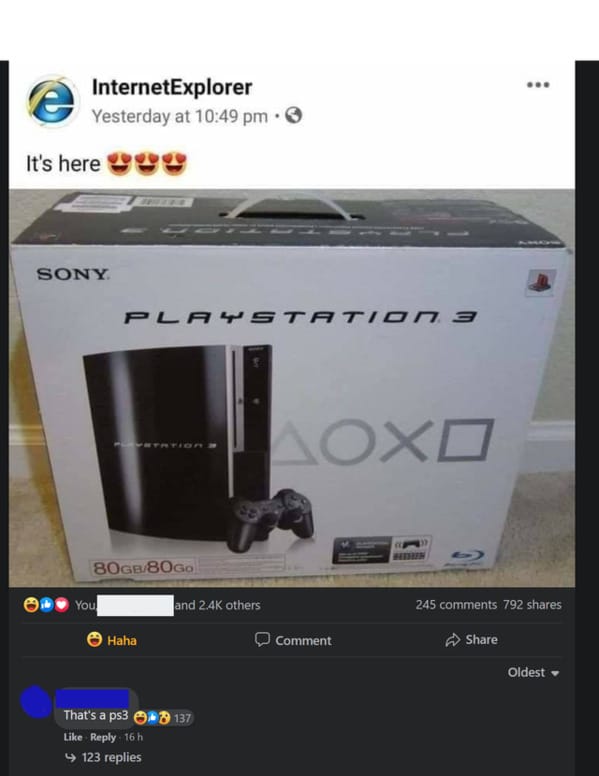
Identify the location of wainscoting. (17, 448), (552, 449).